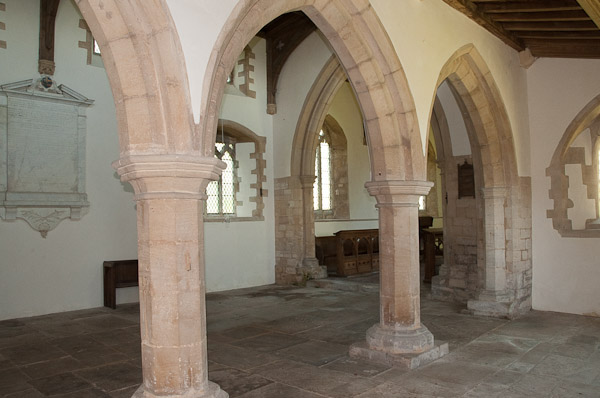
You are a GUI agent. You are given a task and a screenshot of the screen. Output one action in this format:
    pyautogui.click(x=<x>, y=<y>)
    Task: Click on the top windows
    Image resolution: width=600 pixels, height=398 pixels.
    Given the screenshot: What is the action you would take?
    pyautogui.click(x=98, y=47), pyautogui.click(x=234, y=76)